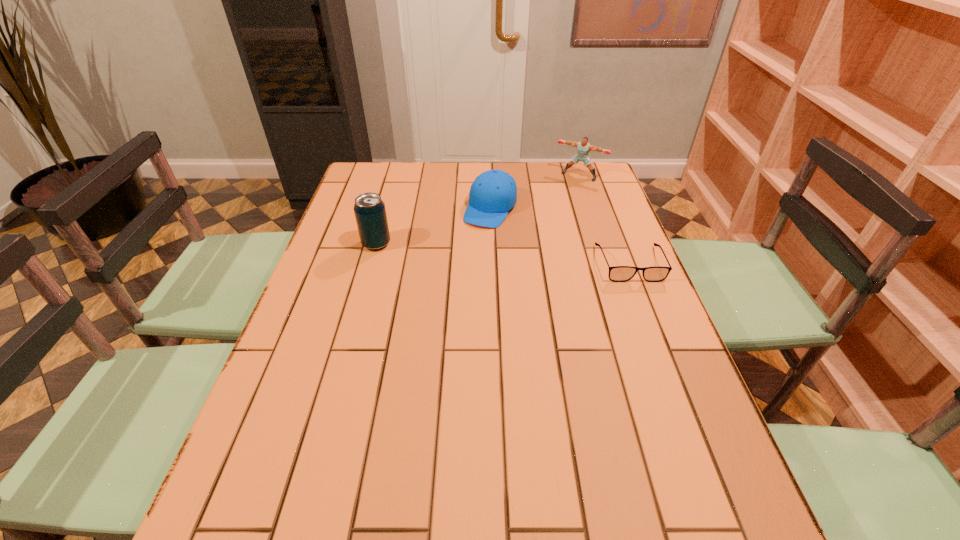
Identify the location of free spot at the near edge of the desktop. (563, 449).

This screenshot has width=960, height=540. In the image, there is a desktop. Identify the location of free space at the left edge. (343, 261).

Locate an element on the screen. The height and width of the screenshot is (540, 960). vacant space at the right edge of the desktop is located at coordinates (594, 217).

In the image, there is a desktop. Identify the location of vacant space at the far left corner. Image resolution: width=960 pixels, height=540 pixels. (360, 179).

In the image, there is a desktop. Where is `vacant space at the far right corner`? This screenshot has height=540, width=960. vacant space at the far right corner is located at coordinates (573, 180).

The width and height of the screenshot is (960, 540). Identify the location of vacant area between the shortest object and the soda can. (503, 253).

Find the location of `free spot between the farthest object and the third nearest object`. free spot between the farthest object and the third nearest object is located at coordinates (535, 192).

You are a GUI agent. You are given a task and a screenshot of the screen. Output one action in this format:
    pyautogui.click(x=<x>, y=<y>)
    Task: Click on the free space between the shortest object and the second shortest object
    This screenshot has height=540, width=960.
    Given the screenshot: What is the action you would take?
    pyautogui.click(x=561, y=236)

You are a GUI agent. You are given a task and a screenshot of the screen. Output one action in this format:
    pyautogui.click(x=<x>, y=<y>)
    Task: Click on the free spot between the shortest object and the leftmost object
    This screenshot has width=960, height=540.
    Given the screenshot: What is the action you would take?
    pyautogui.click(x=503, y=253)

Locate an element on the screen. Image resolution: width=960 pixels, height=540 pixels. free spot between the third tallest object and the farthest object is located at coordinates (535, 192).